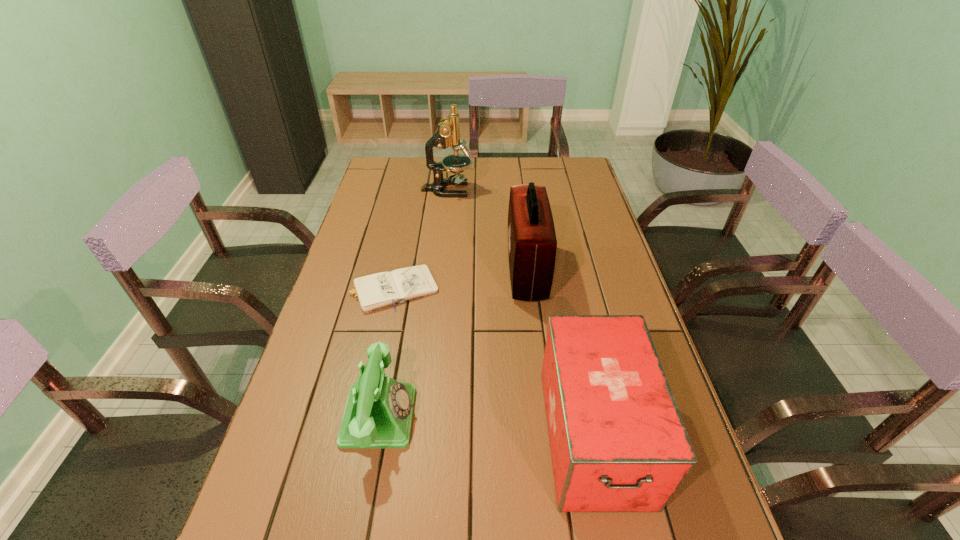
Identify the location of the farthest object. This screenshot has height=540, width=960. (448, 134).

Locate an element on the screen. microscope is located at coordinates (448, 134).

You are a GUI agent. You are given a task and a screenshot of the screen. Output one action in this format:
    pyautogui.click(x=<x>, y=<y>)
    Task: Click on the second tallest object
    This screenshot has height=540, width=960.
    Given the screenshot: What is the action you would take?
    pyautogui.click(x=532, y=244)

The image size is (960, 540). I want to click on the farther first-aid kit, so click(532, 244).

Identify the location of the nearer first-aid kit. The image size is (960, 540). (617, 440).

Where is `the shorter first-aid kit`? The width and height of the screenshot is (960, 540). the shorter first-aid kit is located at coordinates (617, 440).

Identify the location of telephone. The height and width of the screenshot is (540, 960). (378, 414).

What are the coordinates of `the shortest object` in the screenshot? It's located at (375, 291).

Locate an element on the screen. vacant space situated at the eyepiece of the microscope is located at coordinates (569, 190).

The width and height of the screenshot is (960, 540). I want to click on free region located on the side of the farther first-aid kit with the cross symbol, so click(x=410, y=271).